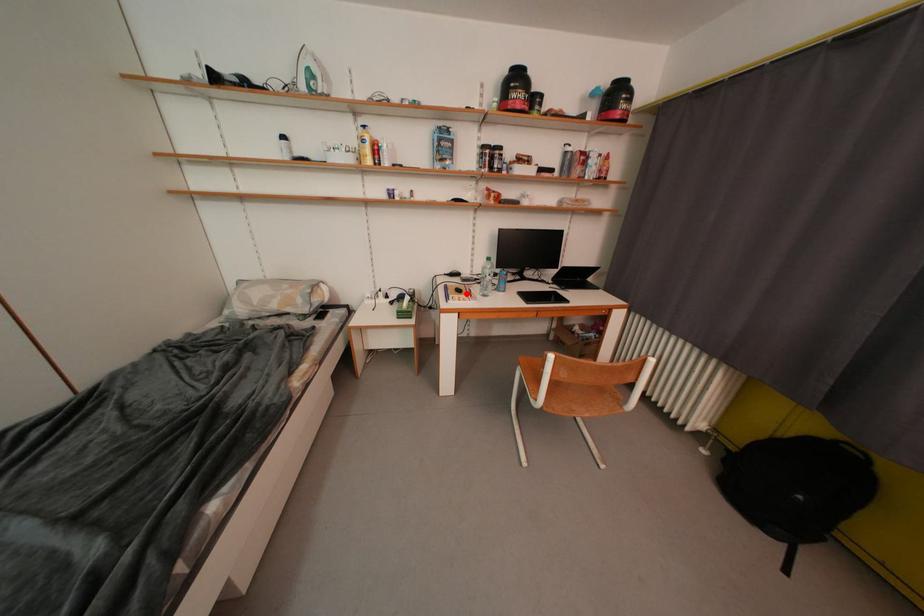
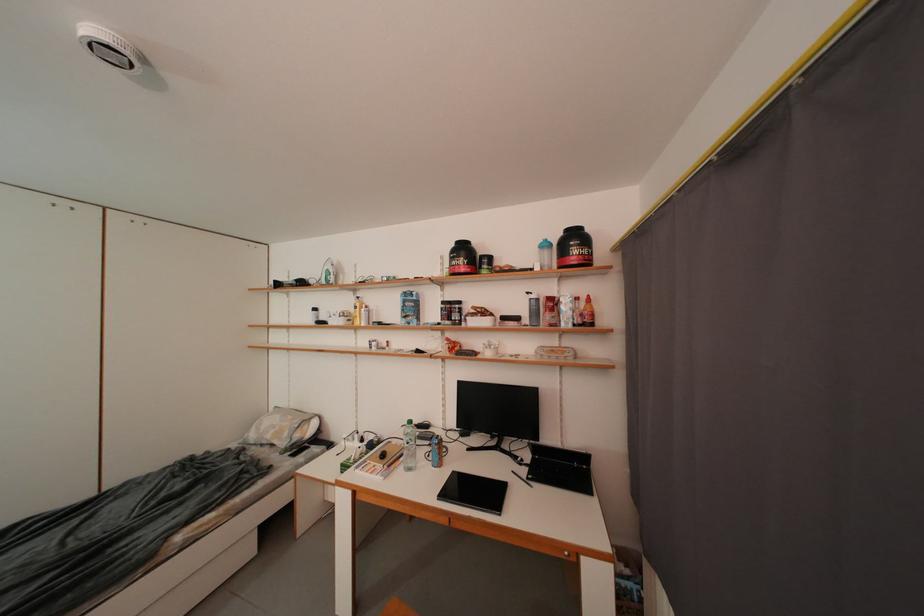
Locate, in the second image, the point that corresponds to the highlighted location in the first image.

(391, 459)